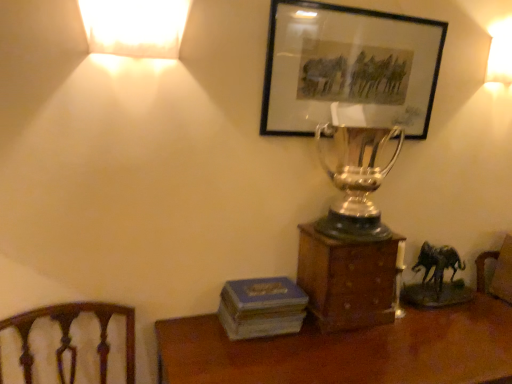
The height and width of the screenshot is (384, 512). What are the coordinates of `free point above wooden desk at lower center (from a real-world perspective)` in the screenshot? It's located at (360, 347).